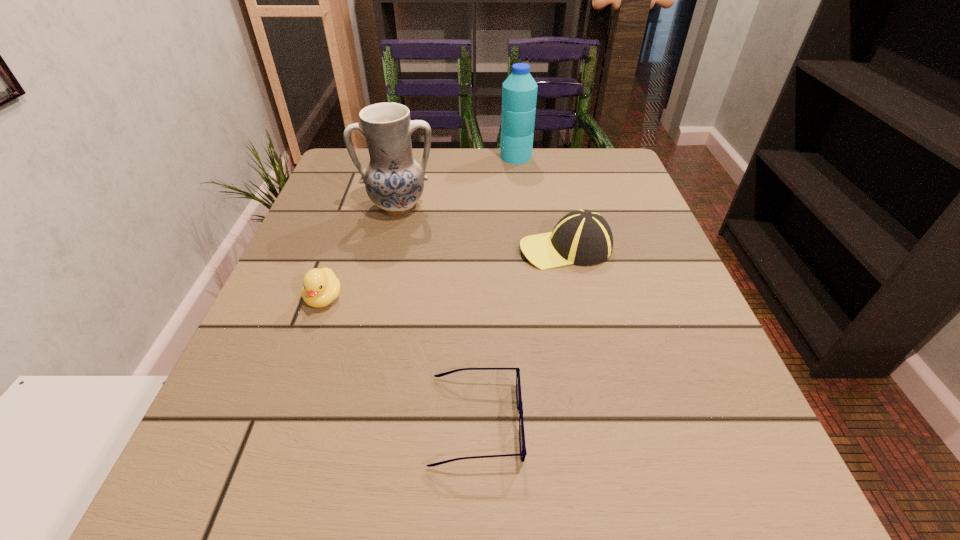
At what (x,y) coordinates should I click in order to perform the action: click on the farthest object. Please return your answer as a coordinate pair (x, y). Looking at the image, I should click on (519, 91).

In order to click on pottery in this screenshot , I will do `click(394, 181)`.

Where is `the third farthest object`? the third farthest object is located at coordinates (583, 237).

What are the coordinates of `the fourth farthest object` in the screenshot? It's located at (321, 287).

Where is `spectacles`? Image resolution: width=960 pixels, height=540 pixels. spectacles is located at coordinates (523, 452).

You are a GUI agent. You are given a task and a screenshot of the screen. Output one action in this format:
    pyautogui.click(x=<x>, y=<y>)
    Task: Click on the shortest object
    This screenshot has height=540, width=960.
    Given the screenshot: What is the action you would take?
    pyautogui.click(x=523, y=452)

The height and width of the screenshot is (540, 960). I want to click on vacant space located on the left of the water bottle, so click(x=421, y=157).

The height and width of the screenshot is (540, 960). I want to click on vacant space located 0.100m on the back of the pottery, so point(407,170).

This screenshot has width=960, height=540. I want to click on free region located 0.350m with the brim of the baseball cap facing forward, so click(x=346, y=248).

Image resolution: width=960 pixels, height=540 pixels. I want to click on free region located 0.100m with the brim of the baseball cap facing forward, so click(x=469, y=248).